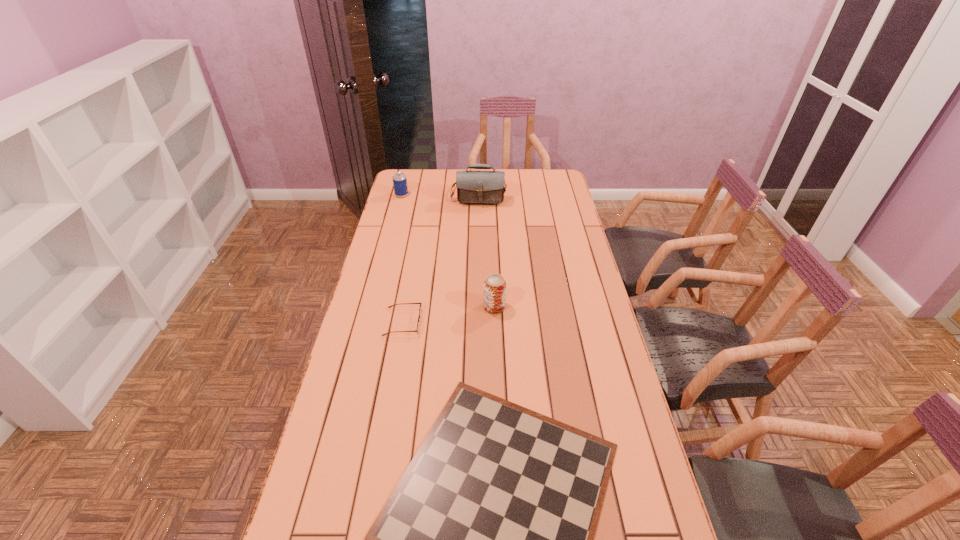
The width and height of the screenshot is (960, 540). I want to click on shoulder bag, so click(472, 186).

Find the location of a particular element. Image resolution: width=960 pixels, height=540 pixels. the right beer can is located at coordinates (494, 299).

At what (x,y) coordinates should I click in order to perform the action: click on the farther beer can. Please return your answer as a coordinate pair (x, y). Image resolution: width=960 pixels, height=540 pixels. Looking at the image, I should click on (399, 178).

What are the coordinates of `the left beer can` in the screenshot? It's located at (399, 178).

The height and width of the screenshot is (540, 960). I want to click on the shortest object, so click(x=419, y=316).

Image resolution: width=960 pixels, height=540 pixels. Identify the location of free space located 0.210m on the front of the tallest object. (478, 235).

You are a GUI agent. You are given a task and a screenshot of the screen. Output one action in this format:
    pyautogui.click(x=<x>, y=<y>)
    Task: Click on the blank space located 0.060m on the right of the right beer can
    This screenshot has height=540, width=960.
    Given the screenshot: What is the action you would take?
    pyautogui.click(x=522, y=307)

Where is `vacant area situated 0.270m on the right of the farther beer can`? vacant area situated 0.270m on the right of the farther beer can is located at coordinates (465, 195).

I want to click on vacant space positioned 0.400m on the front-facing side of the spectacles, so click(539, 322).

Find the location of `shoulder bag at the far edge`. shoulder bag at the far edge is located at coordinates (472, 186).